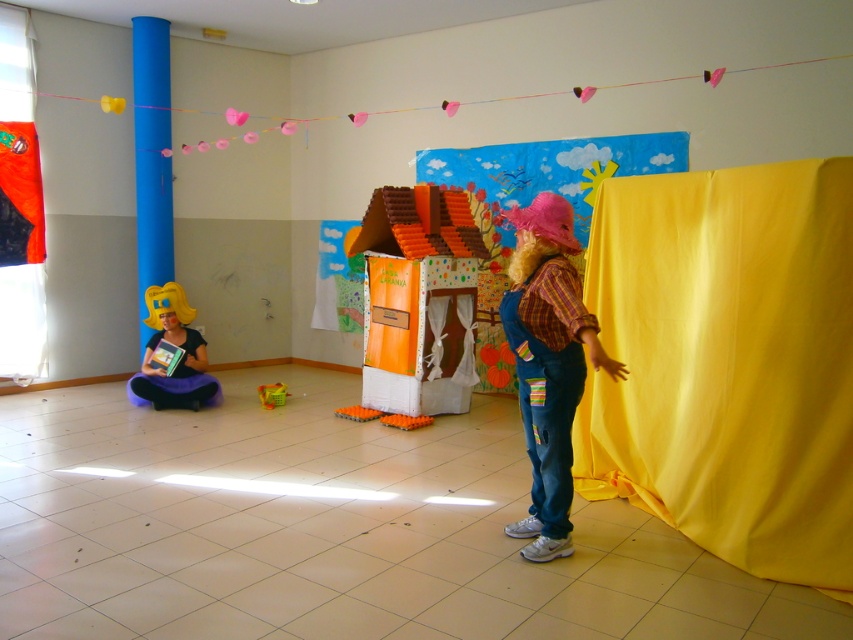
Question: Which object appears closest to the camera in this image?

Choices:
 (A) denim overalls at right
 (B) orange cardboard house at center

Answer: (A)

Question: Does blue glossy column at left have a greater width compared to translucent plastic toy at center?

Choices:
 (A) yes
 (B) no

Answer: (A)

Question: Which point is farther to the camera?

Choices:
 (A) (444, 230)
 (B) (814, 452)
 (C) (136, 236)
 (D) (10, 179)

Answer: (C)

Question: Which object is closer to the camera taking this photo?

Choices:
 (A) matte yellow wig at left
 (B) translucent plastic toy at center
 (C) yellow fabric curtain at right

Answer: (C)

Question: Does yellow fabric at right appear on the left side of yellow fabric curtain at right?

Choices:
 (A) yes
 (B) no

Answer: (B)

Question: From the image, what is the correct spatial relationship of matte yellow wig at left in relation to orange plastic toy at center?

Choices:
 (A) below
 (B) above

Answer: (B)